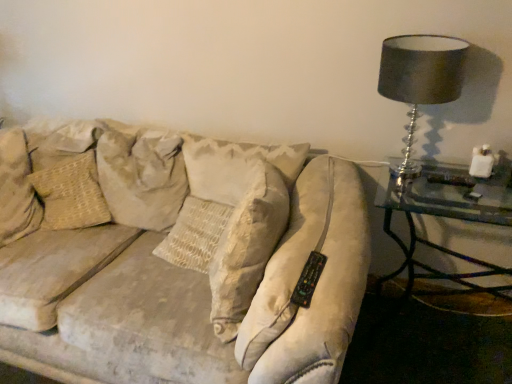
Question: Is beige fabric pillow at upper left, the second pillow from the left, oriented away from clear glass table at right?

Choices:
 (A) no
 (B) yes

Answer: (A)

Question: Considering the relative positions of beige fabric pillow at upper left, the second pillow from the left, and clear glass table at right in the image provided, is beige fabric pillow at upper left, the second pillow from the left, to the left of clear glass table at right from the viewer's perspective?

Choices:
 (A) yes
 (B) no

Answer: (A)

Question: Can you confirm if beige fabric pillow at upper left, which is counted as the 1th pillow, starting from the right, is smaller than clear glass table at right?

Choices:
 (A) no
 (B) yes

Answer: (B)

Question: Is beige fabric pillow at upper left, the second pillow from the left, far from clear glass table at right?

Choices:
 (A) yes
 (B) no

Answer: (A)

Question: From a real-world perspective, is beige fabric pillow at upper left, which is counted as the 1th pillow, starting from the right, on clear glass table at right?

Choices:
 (A) yes
 (B) no

Answer: (A)

Question: From a real-world perspective, is beige textured pillow at left, which ranks as the 1th pillow in left-to-right order, physically located above or below beige fabric pillow at upper left, which is counted as the 1th pillow, starting from the right?

Choices:
 (A) above
 (B) below

Answer: (B)

Question: Considering the positions of beige textured pillow at left, the second pillow when ordered from right to left, and beige fabric pillow at upper left, the second pillow from the left, in the image, is beige textured pillow at left, the second pillow when ordered from right to left, bigger or smaller than beige fabric pillow at upper left, the second pillow from the left,?

Choices:
 (A) big
 (B) small

Answer: (B)

Question: Considering the positions of beige textured pillow at left, the second pillow when ordered from right to left, and beige fabric pillow at upper left, the second pillow from the left, in the image, is beige textured pillow at left, the second pillow when ordered from right to left, taller or shorter than beige fabric pillow at upper left, the second pillow from the left,?

Choices:
 (A) short
 (B) tall

Answer: (A)

Question: From the image's perspective, is beige textured pillow at left, which ranks as the 1th pillow in left-to-right order, located above or below beige fabric pillow at upper left, the second pillow from the left?

Choices:
 (A) below
 (B) above

Answer: (A)

Question: Relative to matte black lampshade at upper right, is beige fabric pillow at upper left, which is counted as the 1th pillow, starting from the right, in front or behind?

Choices:
 (A) front
 (B) behind

Answer: (B)

Question: From the image's perspective, is beige fabric pillow at upper left, which is counted as the 1th pillow, starting from the right, positioned above or below matte black lampshade at upper right?

Choices:
 (A) above
 (B) below

Answer: (B)

Question: Looking at their shapes, would you say beige fabric pillow at upper left, which is counted as the 1th pillow, starting from the right, is wider or thinner than matte black lampshade at upper right?

Choices:
 (A) thin
 (B) wide

Answer: (B)

Question: Is beige fabric pillow at upper left, which is counted as the 1th pillow, starting from the right, situated inside matte black lampshade at upper right or outside?

Choices:
 (A) inside
 (B) outside

Answer: (B)

Question: From the image's perspective, relative to beige fabric pillow at upper left, which is counted as the 1th pillow, starting from the right, is matte black lampshade at upper right above or below?

Choices:
 (A) above
 (B) below

Answer: (A)

Question: Considering the positions of matte black lampshade at upper right and beige fabric pillow at upper left, the second pillow from the left, in the image, is matte black lampshade at upper right bigger or smaller than beige fabric pillow at upper left, the second pillow from the left,?

Choices:
 (A) small
 (B) big

Answer: (A)